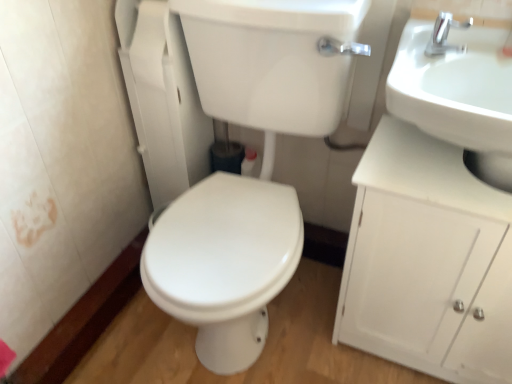
Question: Does silver metallic faucet at upper right lie in front of white glossy sink at upper right?

Choices:
 (A) yes
 (B) no

Answer: (B)

Question: Would you say silver metallic faucet at upper right is outside white glossy sink at upper right?

Choices:
 (A) no
 (B) yes

Answer: (A)

Question: Considering the relative sizes of silver metallic faucet at upper right and white glossy sink at upper right in the image provided, is silver metallic faucet at upper right bigger than white glossy sink at upper right?

Choices:
 (A) no
 (B) yes

Answer: (A)

Question: Considering the relative sizes of silver metallic faucet at upper right and white glossy sink at upper right in the image provided, is silver metallic faucet at upper right smaller than white glossy sink at upper right?

Choices:
 (A) no
 (B) yes

Answer: (B)

Question: Can you confirm if silver metallic faucet at upper right is taller than white glossy sink at upper right?

Choices:
 (A) no
 (B) yes

Answer: (A)

Question: Is silver metallic faucet at upper right inside the boundaries of white glossy sink at upper right, or outside?

Choices:
 (A) outside
 (B) inside

Answer: (A)

Question: Looking at their shapes, would you say silver metallic faucet at upper right is wider or thinner than white glossy sink at upper right?

Choices:
 (A) wide
 (B) thin

Answer: (B)

Question: In terms of height, does silver metallic faucet at upper right look taller or shorter compared to white glossy sink at upper right?

Choices:
 (A) tall
 (B) short

Answer: (B)

Question: From the image's perspective, is silver metallic faucet at upper right positioned above or below white glossy sink at upper right?

Choices:
 (A) above
 (B) below

Answer: (A)

Question: From the image's perspective, is white matte cabinet at right positioned above or below white glossy sink at upper right?

Choices:
 (A) below
 (B) above

Answer: (A)

Question: Based on their positions, is white matte cabinet at right located to the left or right of white glossy sink at upper right?

Choices:
 (A) left
 (B) right

Answer: (B)

Question: Based on their sizes in the image, would you say white matte cabinet at right is bigger or smaller than white glossy sink at upper right?

Choices:
 (A) big
 (B) small

Answer: (A)

Question: Is white matte cabinet at right inside or outside of white glossy sink at upper right?

Choices:
 (A) inside
 (B) outside

Answer: (B)

Question: Is white matte cabinet at right spatially inside white glossy sink at upper right, or outside of it?

Choices:
 (A) outside
 (B) inside

Answer: (A)

Question: Is white matte cabinet at right wider or thinner than white glossy sink at upper right?

Choices:
 (A) wide
 (B) thin

Answer: (B)